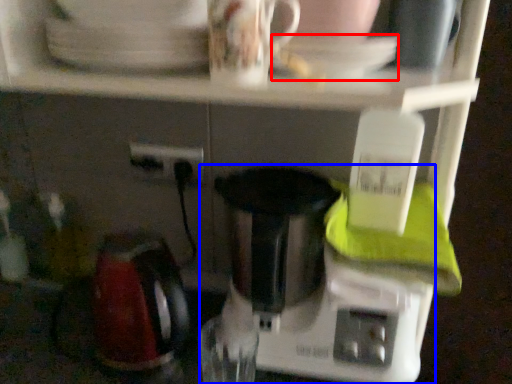
Question: Which object appears closest to the camera in this image, saucer (highlighted by a red box) or mixer (highlighted by a blue box)?

Choices:
 (A) saucer
 (B) mixer

Answer: (A)